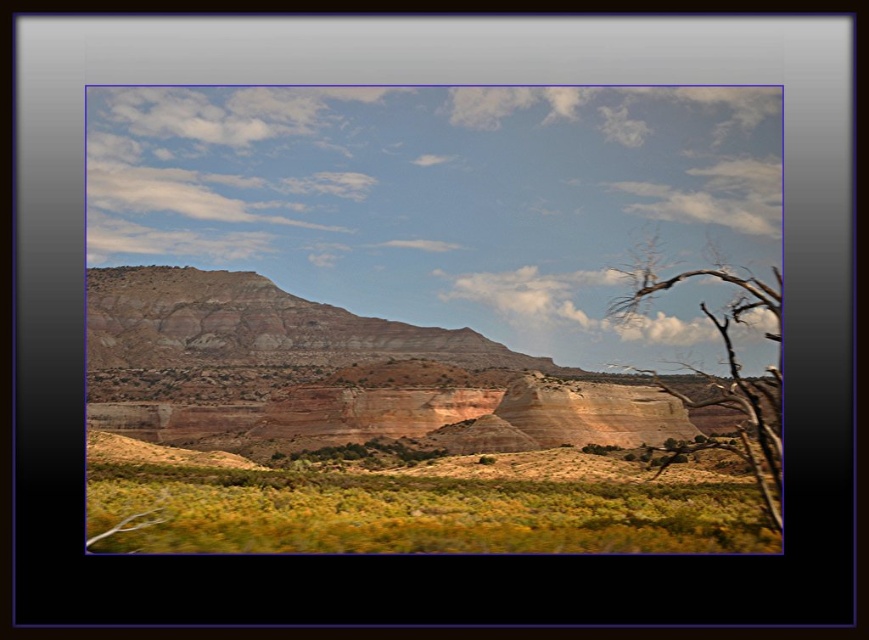
Can you confirm if rustic sandstone cliffs at center is positioned to the right of green shrubbery at lower center?

Incorrect, rustic sandstone cliffs at center is not on the right side of green shrubbery at lower center.

Does point (372, 323) come in front of point (116, 440)?

That is False.

Where is `rustic sandstone cliffs at center`? rustic sandstone cliffs at center is located at coordinates (387, 433).

Does green shrubbery at lower center appear on the left side of brown dry wood at right?

Correct, you'll find green shrubbery at lower center to the left of brown dry wood at right.

Is green shrubbery at lower center taller than brown dry wood at right?

In fact, green shrubbery at lower center may be shorter than brown dry wood at right.

Locate an element on the screen. This screenshot has width=869, height=640. green shrubbery at lower center is located at coordinates (416, 504).

Does rustic sandstone cliffs at center come in front of brown dry wood at right?

Yes, rustic sandstone cliffs at center is closer to the viewer.

Identify the location of rustic sandstone cliffs at center. (x=387, y=433).